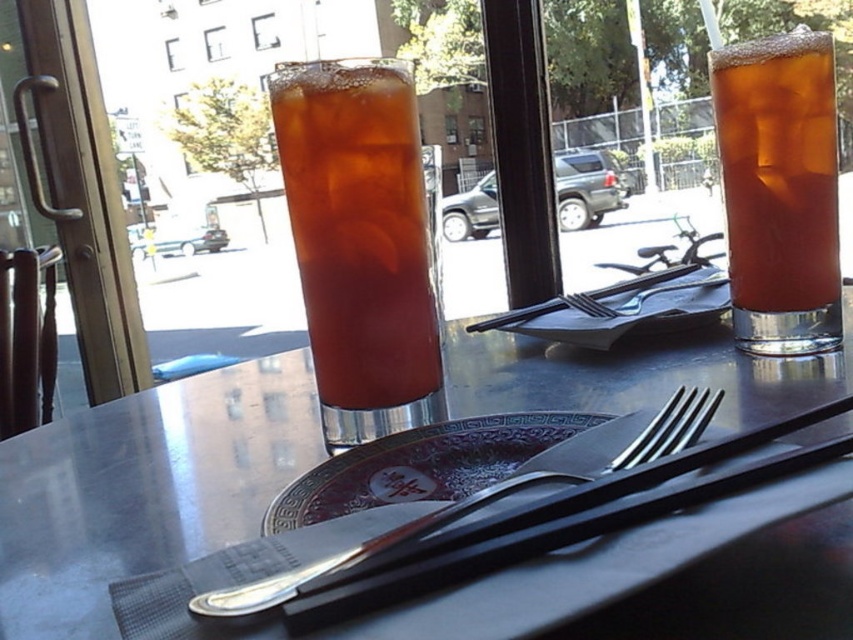
You are a waiter who needs to place a dessert plate between the brown matte glass at center and the silver plated fork at center. Given that the dessert plate has a diameter of 25 cm, can you fit it between them without moving either object?

The brown matte glass at center has a lesser width compared to silver plated fork at center. Therefore, the distance between them is determined by the narrower object, which is the brown matte glass. Since the dessert plate requires 25 cm, but the space between the two objects is less than 25 cm, the plate cannot be placed there without moving either object.

You are a customer at the table and want to place the silver plated fork at center into the brown matte glass at center. Will the fork fit inside the glass?

The brown matte glass at center has a smaller size compared to silver plated fork at center, so the fork may not fit inside the glass due to its larger size.